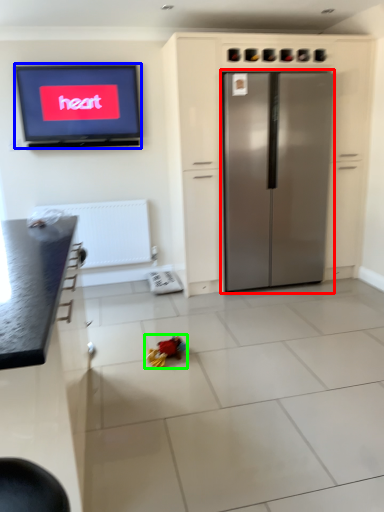
Question: Which object is positioned farthest from refrigerator (highlighted by a red box)? Select from television (highlighted by a blue box) and toy (highlighted by a green box).

Choices:
 (A) television
 (B) toy

Answer: (B)